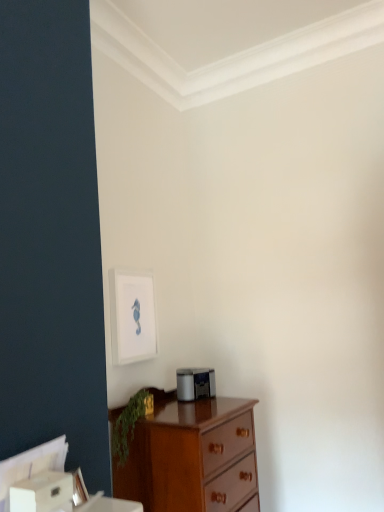
Question: Can you confirm if white matte picture frame at upper center is positioned to the right of green leafy plant at lower left?

Choices:
 (A) no
 (B) yes

Answer: (A)

Question: Does white matte picture frame at upper center turn towards green leafy plant at lower left?

Choices:
 (A) no
 (B) yes

Answer: (A)

Question: Considering the relative sizes of white matte picture frame at upper center and green leafy plant at lower left in the image provided, is white matte picture frame at upper center bigger than green leafy plant at lower left?

Choices:
 (A) yes
 (B) no

Answer: (A)

Question: Does white matte picture frame at upper center have a greater height compared to green leafy plant at lower left?

Choices:
 (A) yes
 (B) no

Answer: (A)

Question: Can you confirm if white matte picture frame at upper center is thinner than green leafy plant at lower left?

Choices:
 (A) no
 (B) yes

Answer: (B)

Question: Is wooden chest of drawers at lower left wider or thinner than white matte picture frame at upper center?

Choices:
 (A) wide
 (B) thin

Answer: (A)

Question: Is point (132, 461) positioned closer to the camera than point (117, 342)?

Choices:
 (A) closer
 (B) farther

Answer: (A)

Question: Based on their sizes in the image, would you say wooden chest of drawers at lower left is bigger or smaller than white matte picture frame at upper center?

Choices:
 (A) small
 (B) big

Answer: (B)

Question: From the image's perspective, relative to white matte picture frame at upper center, is wooden chest of drawers at lower left above or below?

Choices:
 (A) above
 (B) below

Answer: (B)

Question: Is white matte picture frame at upper center in front of or behind green leafy plant at lower left in the image?

Choices:
 (A) front
 (B) behind

Answer: (B)

Question: Considering the positions of point (152, 350) and point (140, 394), is point (152, 350) closer or farther from the camera than point (140, 394)?

Choices:
 (A) farther
 (B) closer

Answer: (A)

Question: From their relative heights in the image, would you say white matte picture frame at upper center is taller or shorter than green leafy plant at lower left?

Choices:
 (A) short
 (B) tall

Answer: (B)

Question: From a real-world perspective, is white matte picture frame at upper center above or below green leafy plant at lower left?

Choices:
 (A) below
 (B) above

Answer: (B)

Question: In terms of size, does wooden chest of drawers at lower left appear bigger or smaller than green leafy plant at lower left?

Choices:
 (A) big
 (B) small

Answer: (A)

Question: Visually, is wooden chest of drawers at lower left positioned to the left or to the right of green leafy plant at lower left?

Choices:
 (A) left
 (B) right

Answer: (B)